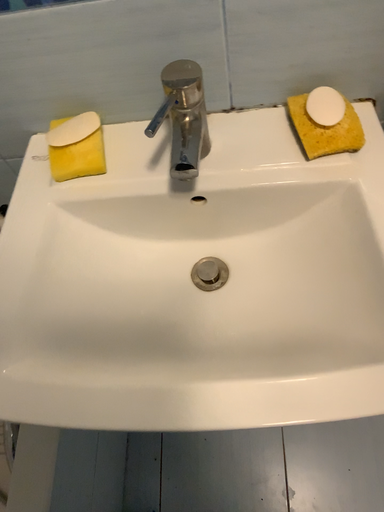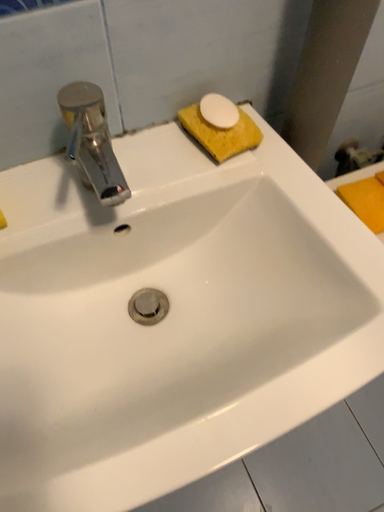
Question: Which way did the camera rotate in the video?

Choices:
 (A) rotated downward
 (B) rotated upward

Answer: (B)